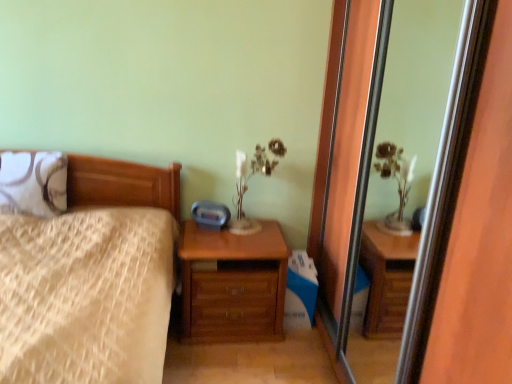
Question: Considering their positions, is transparent glass screen door at center located in front of or behind matte white glass table lamp at upper center?

Choices:
 (A) behind
 (B) front

Answer: (B)

Question: From the image's perspective, is transparent glass screen door at center above or below matte white glass table lamp at upper center?

Choices:
 (A) above
 (B) below

Answer: (B)

Question: Which is nearer to the white textured pillow at left?

Choices:
 (A) wooden bed at left
 (B) wooden chest of drawers at lower center
 (C) transparent glass screen door at center
 (D) matte white glass table lamp at upper center

Answer: (A)

Question: Estimate the real-world distances between objects in this image. Which object is farther from the white textured pillow at left?

Choices:
 (A) matte white glass table lamp at upper center
 (B) wooden bed at left
 (C) wooden chest of drawers at lower center
 (D) transparent glass screen door at center

Answer: (D)